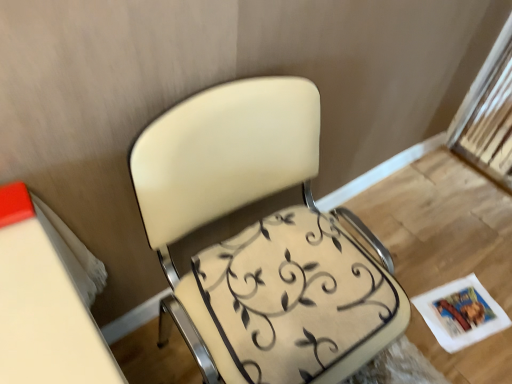
Question: Would you say white paper magazine at lower right is to the left or to the right of matte cream chair at center in the picture?

Choices:
 (A) left
 (B) right

Answer: (B)

Question: From a real-world perspective, relative to matte cream chair at center, is white paper magazine at lower right vertically above or below?

Choices:
 (A) below
 (B) above

Answer: (A)

Question: Based on their relative distances, which object is farther from the matte cream chair at center?

Choices:
 (A) white paper magazine at lower right
 (B) beige fabric swivel chair at center

Answer: (A)

Question: Considering the real-world distances, which object is farthest from the beige fabric swivel chair at center?

Choices:
 (A) white paper magazine at lower right
 (B) matte cream chair at center

Answer: (A)